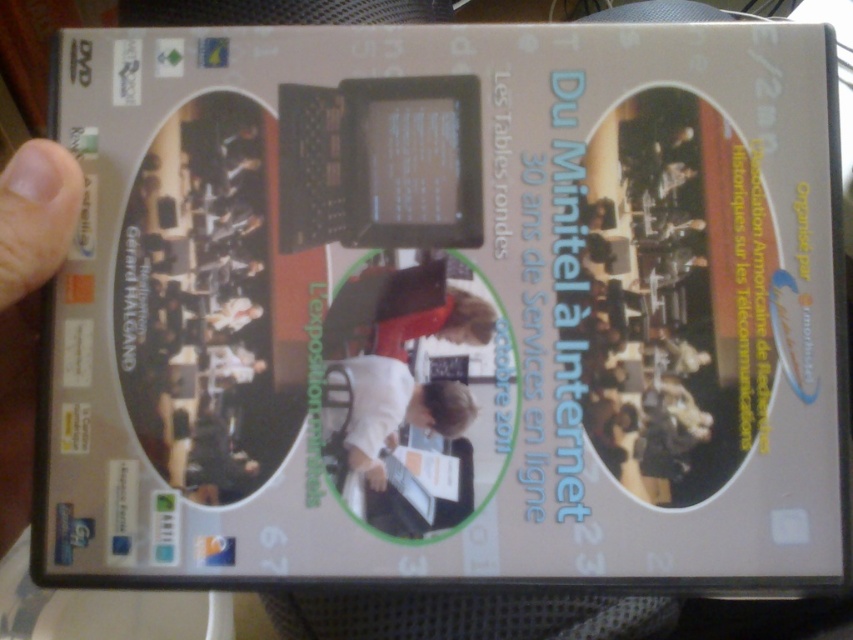
Between point (469, 417) and point (67, 250), which one is positioned in front?

Positioned in front is point (67, 250).

Describe the element at coordinates (386, 410) in the screenshot. I see `white fabric shirt at center` at that location.

Locate an element on the screen. white fabric shirt at center is located at coordinates (386, 410).

Is matte skin hand at lower left further to camera compared to white matte hand at lower center?

That is False.

Is point (10, 193) less distant than point (375, 484)?

Yes, it is.

Where is `matte skin hand at lower left`? matte skin hand at lower left is located at coordinates (35, 216).

Which of these two, white fabric shirt at center or white matte hand at lower center, stands shorter?

Standing shorter between the two is white matte hand at lower center.

Who is taller, white fabric shirt at center or white matte hand at lower center?

With more height is white fabric shirt at center.

Is point (343, 408) behind point (386, 481)?

Yes, it is behind point (386, 481).

Locate an element on the screen. white fabric shirt at center is located at coordinates (386, 410).